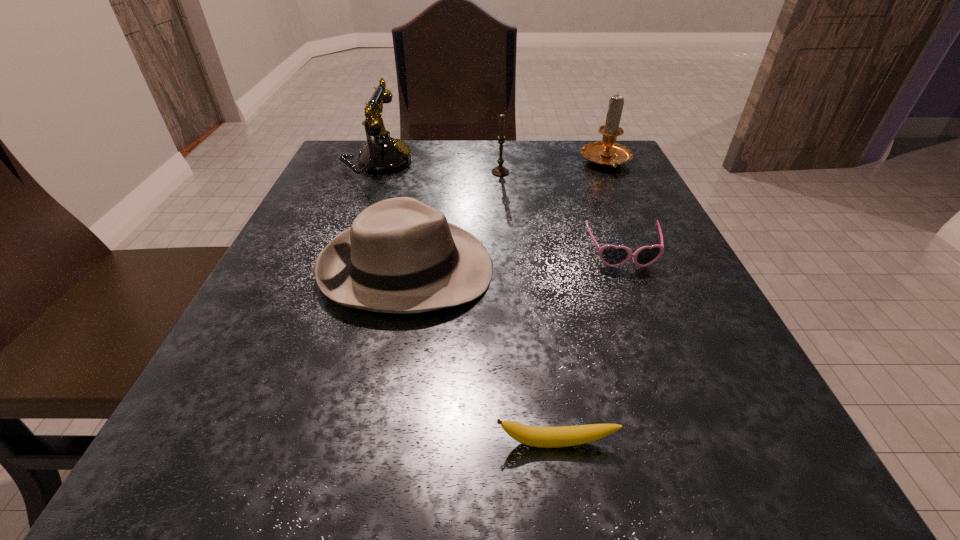
Where is `telephone`? telephone is located at coordinates (383, 154).

What are the coordinates of `the taller candle` in the screenshot? It's located at (607, 153).

Where is `the shorter candle`? This screenshot has width=960, height=540. the shorter candle is located at coordinates (500, 170).

This screenshot has height=540, width=960. Find the location of `the left candle`. the left candle is located at coordinates (500, 170).

Identify the location of fedora. This screenshot has width=960, height=540. (400, 255).

Locate an element on the screen. This screenshot has height=540, width=960. sunglasses is located at coordinates (611, 255).

At what (x,y) coordinates should I click in order to perform the action: click on banana. Please return your answer as a coordinate pair (x, y). This screenshot has width=960, height=540. Looking at the image, I should click on (543, 437).

Find the location of a particular element. vacant region located 0.350m on the dial of the telephone is located at coordinates (562, 163).

Find the location of `free space located 0.350m on the left of the taller candle`. free space located 0.350m on the left of the taller candle is located at coordinates (430, 163).

You are a GUI agent. You are given a task and a screenshot of the screen. Output one action in this format:
    pyautogui.click(x=<x>, y=<y>)
    Task: Click on the blank space located on the right of the shorter candle
    The height and width of the screenshot is (540, 960).
    Given the screenshot: What is the action you would take?
    pyautogui.click(x=629, y=172)